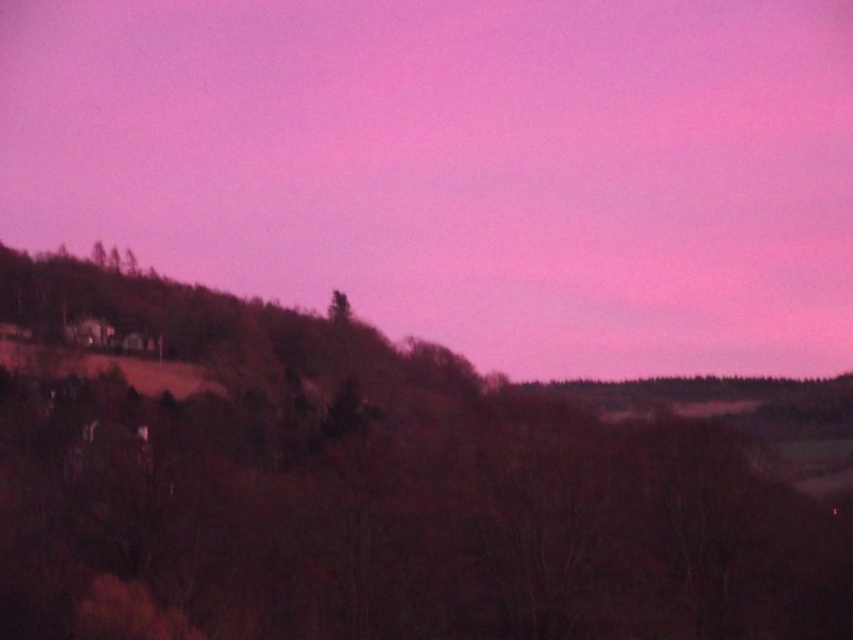
Is matte pink sky at upper center positioned behind brown matte tree at left?

Yes, matte pink sky at upper center is behind brown matte tree at left.

You are a GUI agent. You are given a task and a screenshot of the screen. Output one action in this format:
    pyautogui.click(x=<x>, y=<y>)
    Task: Click on the matte pink sky at upper center
    
    Given the screenshot: What is the action you would take?
    pyautogui.click(x=460, y=166)

Does point (199, 49) come closer to viewer compared to point (328, 481)?

No, it is behind (328, 481).

The image size is (853, 640). I want to click on matte pink sky at upper center, so click(x=460, y=166).

Can you confirm if brown matte tree at left is thinner than green matte tree at center?

No.

Can you confirm if brown matte tree at left is positioned to the left of green matte tree at center?

Correct, you'll find brown matte tree at left to the left of green matte tree at center.

I want to click on brown matte tree at left, so click(x=380, y=492).

The height and width of the screenshot is (640, 853). Identify the location of brown matte tree at left. (380, 492).

In the scene shown: Who is more distant from viewer, (651, 84) or (346, 323)?

The point (651, 84) is more distant.

Who is positioned more to the left, matte pink sky at upper center or green matte tree at center?

green matte tree at center

Who is more distant from viewer, (706, 170) or (334, 316)?

Point (706, 170)

Where is `matte pink sky at upper center`? matte pink sky at upper center is located at coordinates click(x=460, y=166).